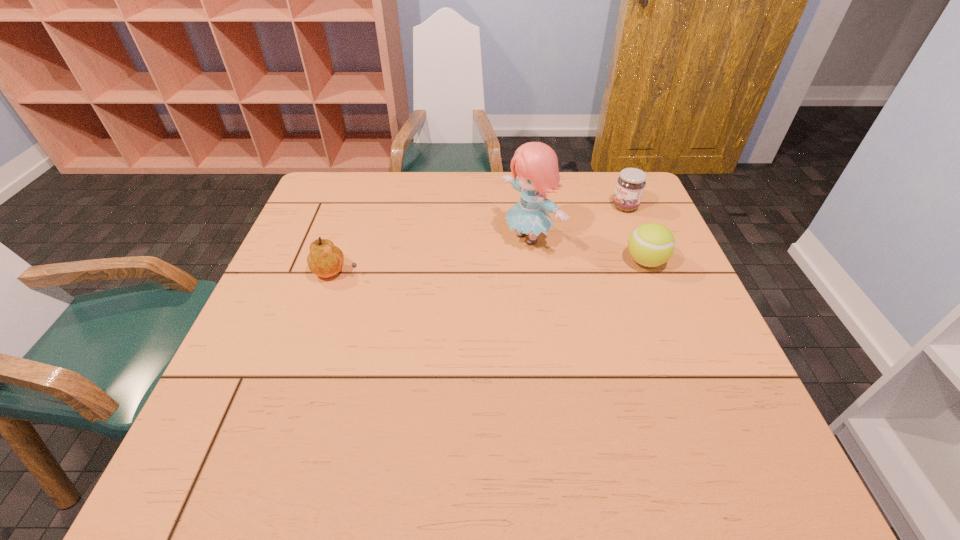
Find the location of a particular element. This screenshot has height=540, width=960. free spot on the desktop that is between the pear and the tennis ball and is positioned on the front label of the farthest object is located at coordinates (491, 267).

Where is `free space on the desktop that is between the pear and the tennis ball and is positioned on the front-facing side of the doll`? The image size is (960, 540). free space on the desktop that is between the pear and the tennis ball and is positioned on the front-facing side of the doll is located at coordinates (467, 268).